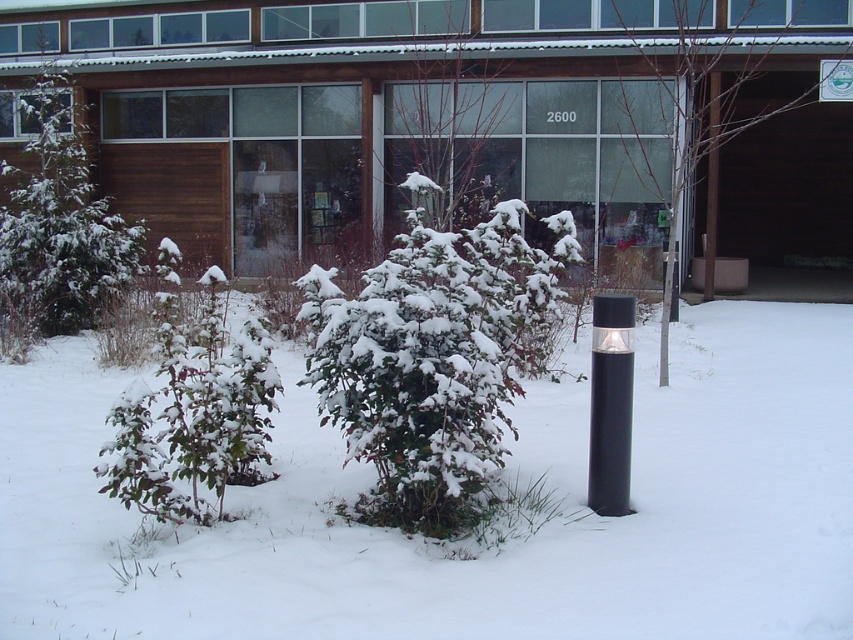
Between white matte snow at center and green matte bush at left, which one appears on the right side from the viewer's perspective?

From the viewer's perspective, white matte snow at center appears more on the right side.

Does white matte snow at center appear over green matte bush at left?

Incorrect, white matte snow at center is not positioned above green matte bush at left.

Measure the distance between point (213, 602) and camera.

They are 13.66 feet apart.

Where is `white matte snow at center`? white matte snow at center is located at coordinates (482, 552).

Who is more forward, (44,456) or (442,308)?

Point (442,308) is in front.

Is white matte snow at center taller than snow-covered bush at center?

In fact, white matte snow at center may be shorter than snow-covered bush at center.

Identify the location of white matte snow at center. (482, 552).

Locate an element on the screen. The image size is (853, 640). white matte snow at center is located at coordinates (482, 552).

Is snow-covered bush at center thinner than bare branches at center?

Yes.

Does snow-covered bush at center appear on the right side of bare branches at center?

In fact, snow-covered bush at center is to the left of bare branches at center.

Between point (390, 388) and point (688, 186), which one is positioned in front?

Point (390, 388) is more forward.

Locate an element on the screen. This screenshot has height=640, width=853. snow-covered bush at center is located at coordinates (434, 358).